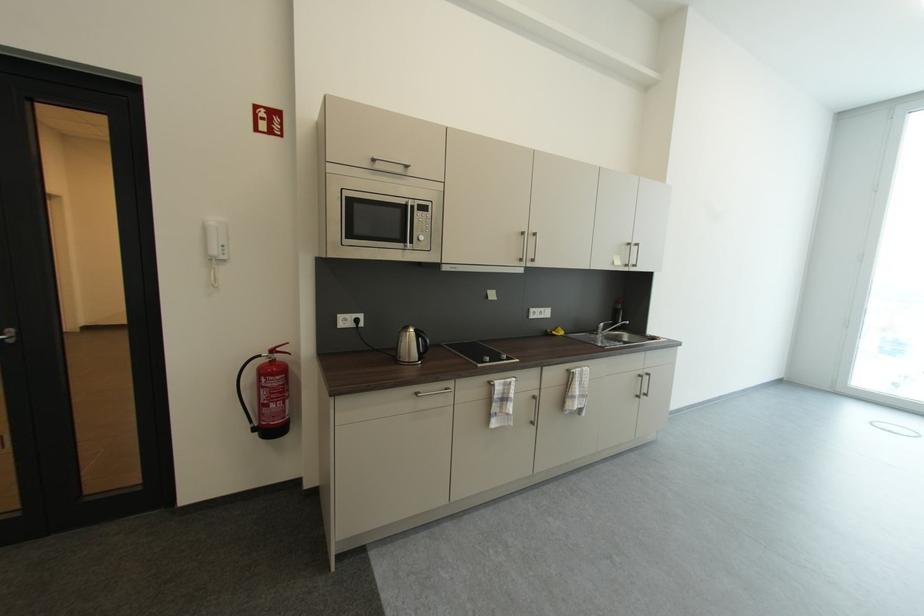
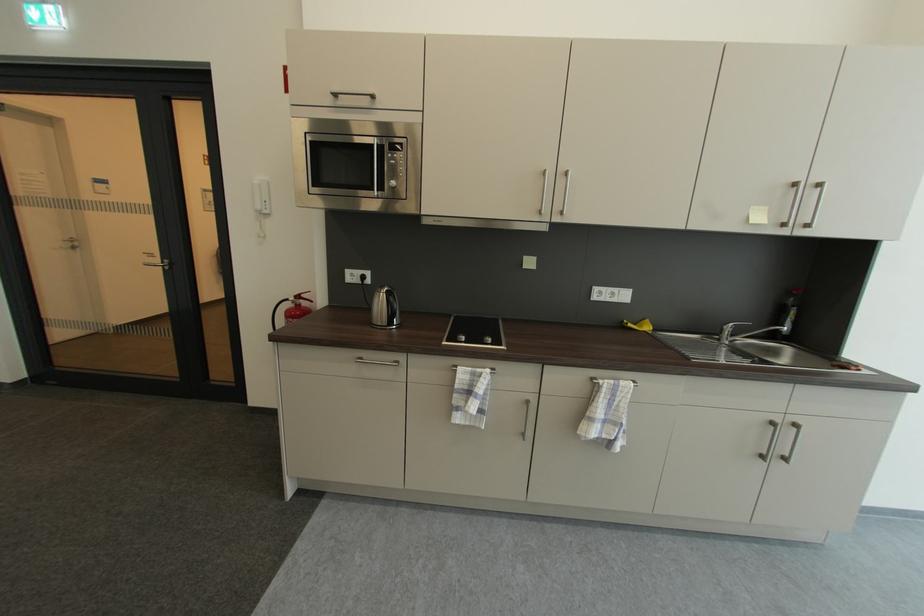
Where in the second image is the point corresponding to (280,352) from the first image?

(305, 299)